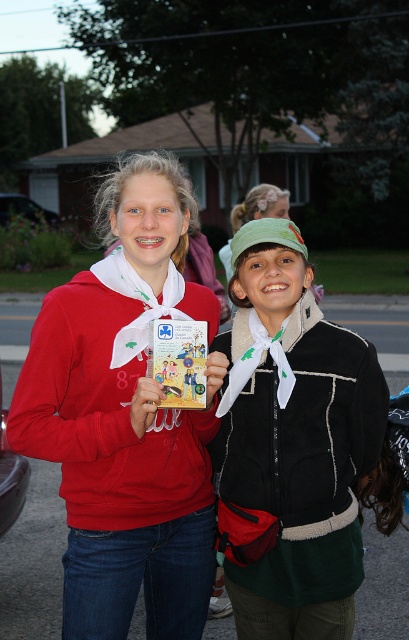
Identify the location of matte red sweatshirt at center. (125, 417).

Does matte red sweatshirt at center have a greater width compared to matte paper comic book at center?

Yes.

Which is behind, point (65, 336) or point (148, 362)?

The point (65, 336) is more distant.

What are the coordinates of `matte red sweatshirt at center` in the screenshot? It's located at (125, 417).

Is matte red sweatshirt at center shorter than black fleece jacket at center?

Yes, matte red sweatshirt at center is shorter than black fleece jacket at center.

Is matte red sweatshirt at center above black fleece jacket at center?

Correct, matte red sweatshirt at center is located above black fleece jacket at center.

Does point (146, 321) come in front of point (274, 353)?

No, it is behind (274, 353).

Where is `matte red sweatshirt at center`? matte red sweatshirt at center is located at coordinates (125, 417).

Looking at this image, does black fleece jacket at center appear over matte paper comic book at center?

Actually, black fleece jacket at center is below matte paper comic book at center.

Can you confirm if black fleece jacket at center is taller than matte paper comic book at center?

Correct, black fleece jacket at center is much taller as matte paper comic book at center.

I want to click on black fleece jacket at center, so click(x=292, y=444).

The image size is (409, 640). Identify the location of black fleece jacket at center. (292, 444).